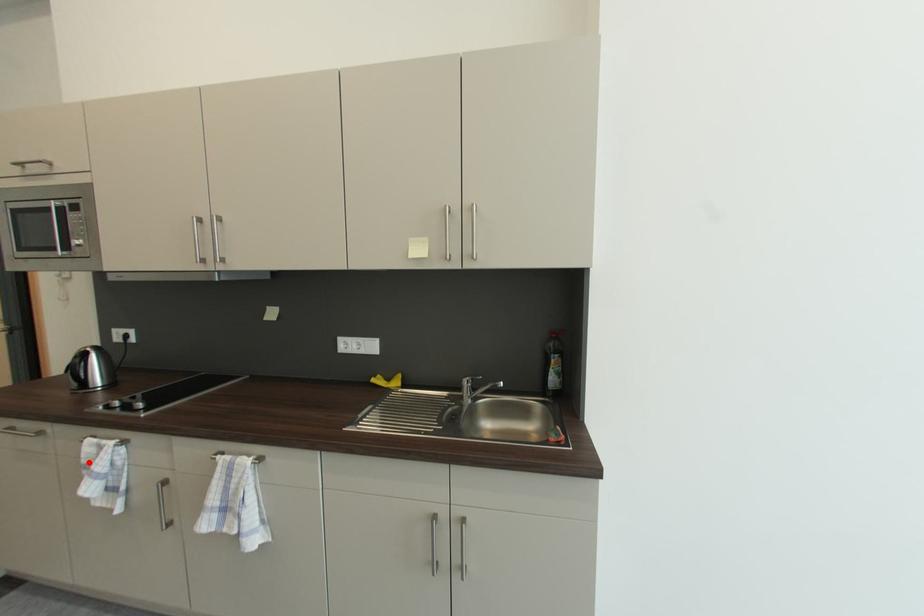
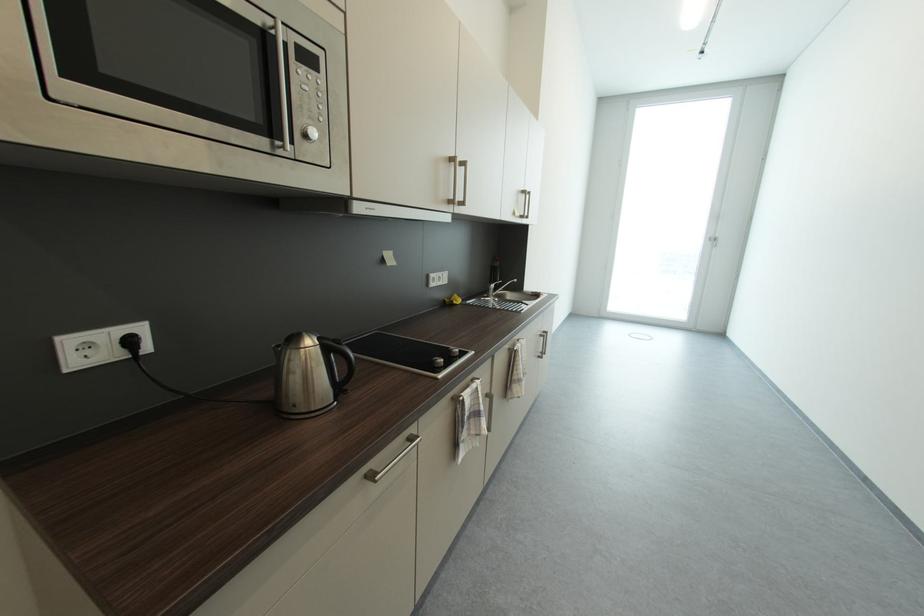
Locate, in the second image, the point that corresponds to the highlighted location in the first image.

(472, 419)